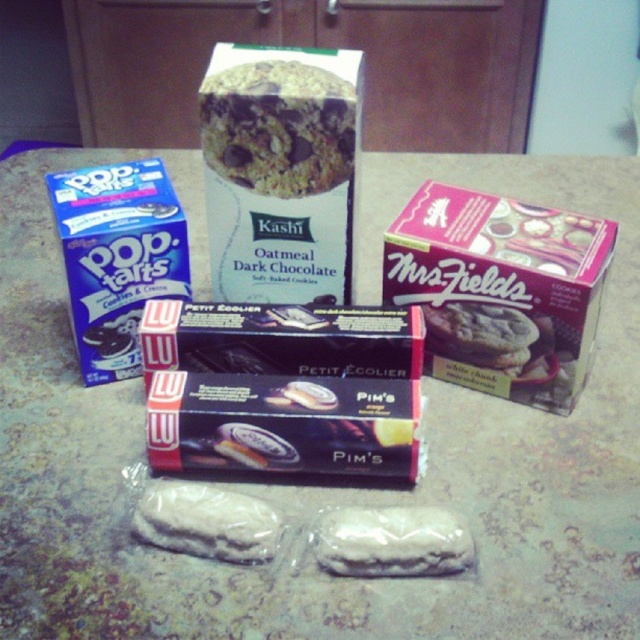
In the scene shown: Where is the pink matte mrsfields cookies at upper right located?

The pink matte mrsfields cookies at upper right is located at point (x=500, y=291).